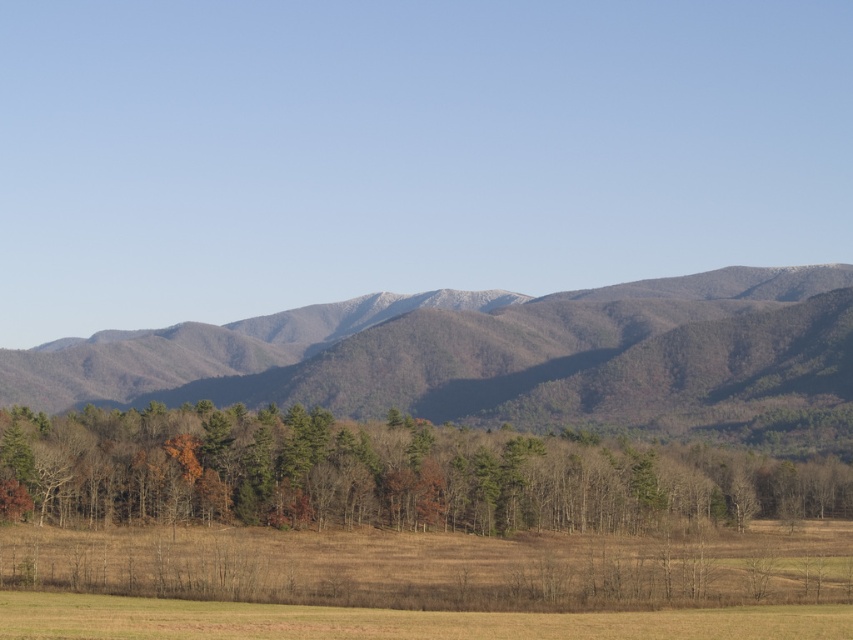
Question: Does gray textured mountain range at center lie behind brown grassland at lower center?

Choices:
 (A) yes
 (B) no

Answer: (A)

Question: Which point is closer to the camera?

Choices:
 (A) (369, 461)
 (B) (381, 634)
 (C) (851, 448)

Answer: (B)

Question: Which of the following is the farthest from the observer?

Choices:
 (A) brown textured trees at center
 (B) brown grassland at lower center

Answer: (A)

Question: Does gray textured mountain range at center appear under brown grassland at lower center?

Choices:
 (A) no
 (B) yes

Answer: (A)

Question: Does gray textured mountain range at center appear on the left side of brown textured trees at center?

Choices:
 (A) no
 (B) yes

Answer: (B)

Question: Among these points, which one is farthest from the camera?

Choices:
 (A) (164, 426)
 (B) (689, 627)
 (C) (439, 310)

Answer: (C)